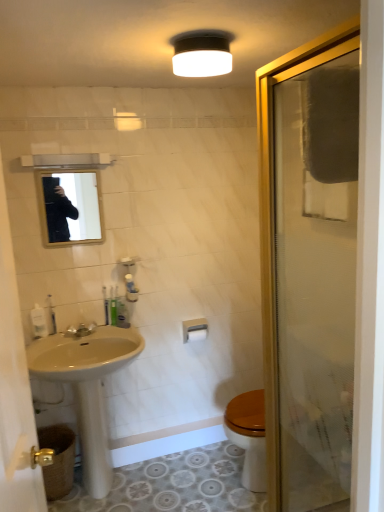
Question: Does translucent plastic soap dispenser at lower left, which is the third toiletry from right to left, lie behind white matte towel bar at center?

Choices:
 (A) no
 (B) yes

Answer: (A)

Question: Are translucent plastic soap dispenser at lower left, which is the third toiletry from right to left, and white matte towel bar at center located far from each other?

Choices:
 (A) yes
 (B) no

Answer: (B)

Question: From a real-world perspective, is translucent plastic soap dispenser at lower left, the 1th toiletry positioned from the left, beneath white matte towel bar at center?

Choices:
 (A) yes
 (B) no

Answer: (B)

Question: Does translucent plastic soap dispenser at lower left, the 1th toiletry positioned from the left, have a greater height compared to white matte towel bar at center?

Choices:
 (A) no
 (B) yes

Answer: (B)

Question: Can you see translucent plastic soap dispenser at lower left, the 1th toiletry positioned from the left, touching white matte towel bar at center?

Choices:
 (A) no
 (B) yes

Answer: (A)

Question: Considering the positions of white matte light fixture at upper center and translucent plastic toothbrush at lower left, which is counted as the 2th toiletry, starting from the left, in the image, is white matte light fixture at upper center taller or shorter than translucent plastic toothbrush at lower left, which is counted as the 2th toiletry, starting from the left,?

Choices:
 (A) tall
 (B) short

Answer: (B)

Question: From a real-world perspective, is white matte light fixture at upper center positioned above or below translucent plastic toothbrush at lower left, which is counted as the 2th toiletry, starting from the left?

Choices:
 (A) below
 (B) above

Answer: (B)

Question: Relative to translucent plastic toothbrush at lower left, the second toiletry positioned from the right, is white matte light fixture at upper center in front or behind?

Choices:
 (A) front
 (B) behind

Answer: (A)

Question: Is white matte light fixture at upper center spatially inside translucent plastic toothbrush at lower left, which is counted as the 2th toiletry, starting from the left, or outside of it?

Choices:
 (A) outside
 (B) inside

Answer: (A)

Question: In terms of width, does clear glass shower door at right look wider or thinner when compared to matte glass mirror at upper center?

Choices:
 (A) thin
 (B) wide

Answer: (B)

Question: In terms of height, does clear glass shower door at right look taller or shorter compared to matte glass mirror at upper center?

Choices:
 (A) short
 (B) tall

Answer: (B)

Question: Is clear glass shower door at right situated inside matte glass mirror at upper center or outside?

Choices:
 (A) inside
 (B) outside

Answer: (B)

Question: Would you say clear glass shower door at right is to the left or to the right of matte glass mirror at upper center in the picture?

Choices:
 (A) left
 (B) right

Answer: (B)

Question: From the image's perspective, is white glossy mirror at upper left located above or below white matte light fixture at upper center?

Choices:
 (A) above
 (B) below

Answer: (B)

Question: In terms of size, does white glossy mirror at upper left appear bigger or smaller than white matte light fixture at upper center?

Choices:
 (A) small
 (B) big

Answer: (B)